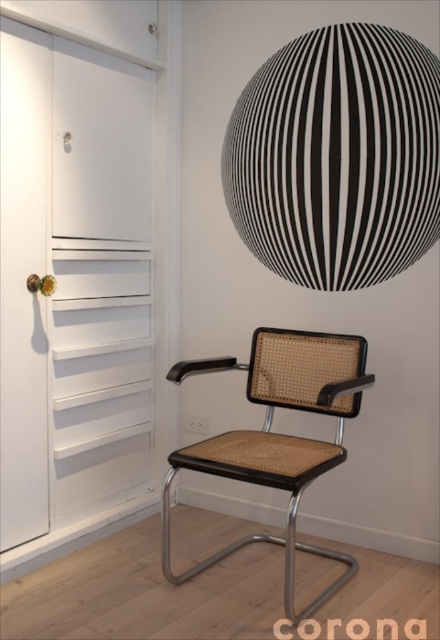
Question: Can you confirm if white matte door at left is smaller than brown cane swivel chair at center?

Choices:
 (A) yes
 (B) no

Answer: (A)

Question: Which object appears farthest from the camera in this image?

Choices:
 (A) brown cane swivel chair at center
 (B) white matte door at left

Answer: (B)

Question: Which is farther from the white glossy door at left?

Choices:
 (A) white matte door at left
 (B) brown cane swivel chair at center

Answer: (B)

Question: Does white matte door at left appear on the right side of white glossy door at left?

Choices:
 (A) yes
 (B) no

Answer: (A)

Question: Which is nearer to the white glossy door at left?

Choices:
 (A) white matte door at left
 (B) brown cane swivel chair at center

Answer: (A)

Question: Does white matte door at left appear under brown cane swivel chair at center?

Choices:
 (A) no
 (B) yes

Answer: (A)